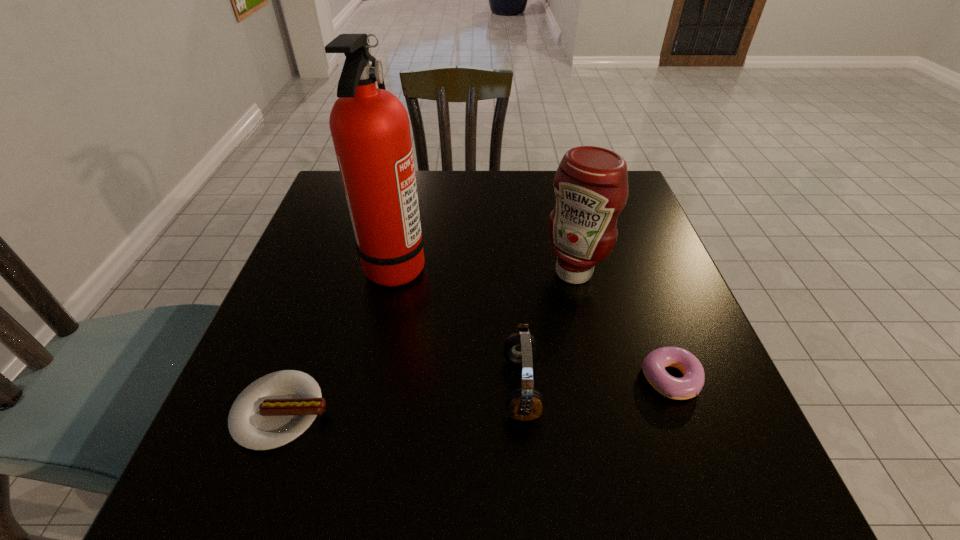
This screenshot has width=960, height=540. Identify the location of vacant space at the near edge of the desktop. (644, 505).

The width and height of the screenshot is (960, 540). What are the coordinates of `vacant area at the left edge` in the screenshot? It's located at (301, 247).

The image size is (960, 540). Find the location of `vacant space at the right edge`. vacant space at the right edge is located at coordinates (667, 303).

Where is `vacant area at the near left corner of the desktop`? This screenshot has height=540, width=960. vacant area at the near left corner of the desktop is located at coordinates (196, 487).

What are the coordinates of `empty space between the rightmost object and the third tallest object` in the screenshot? It's located at click(x=596, y=383).

Locate an element on the screen. This screenshot has height=540, width=960. free space that is in between the third object from left to right and the rightmost object is located at coordinates (596, 383).

The width and height of the screenshot is (960, 540). I want to click on free spot between the third object from left to right and the fire extinguisher, so click(x=459, y=326).

What are the coordinates of `unoccupied area between the doughnut and the tallest object` in the screenshot? It's located at (533, 322).

This screenshot has height=540, width=960. Find the location of `vacant space that's between the doughnut and the fourth shortest object`. vacant space that's between the doughnut and the fourth shortest object is located at coordinates (622, 326).

The image size is (960, 540). Find the location of `free spot between the second tallest object and the fire extinguisher`. free spot between the second tallest object and the fire extinguisher is located at coordinates (485, 268).